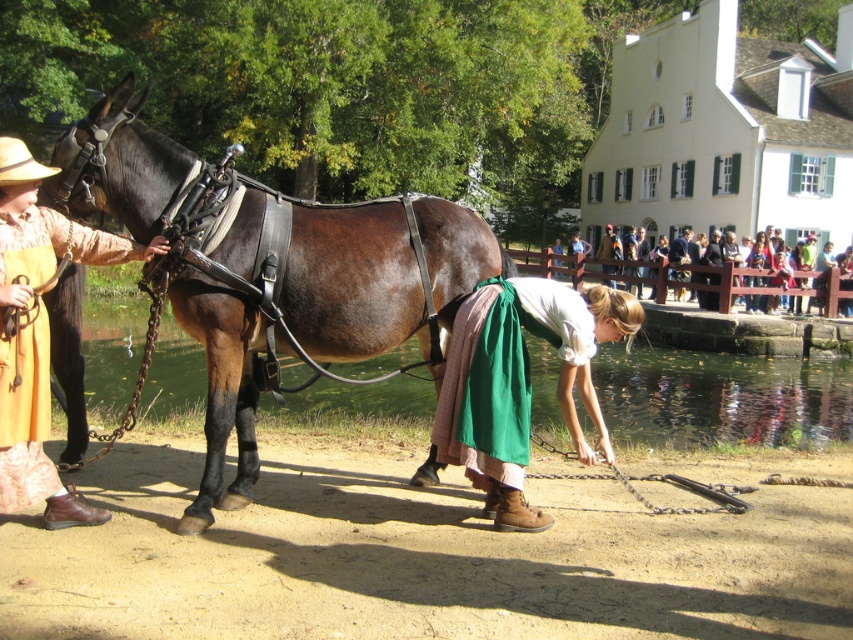
You are standing at the point with coordinates (x=519, y=381) in the historical reenactment scene. What is the object directly beneath your feet?

The point at (x=519, y=381) is on the green fabric skirt at lower center, so the object directly beneath your feet is the green fabric skirt at lower center.

What object is located at the coordinates point (352, 282) in the scene?

The shiny brown leather harness at center is located at point (352, 282).

In the historical reenactment scene near the water, you see a shiny brown leather harness at center and a green fabric skirt at lower center. Which object is positioned to the right side from the observer?

The green fabric skirt at lower center is positioned to the right side from the observer because the shiny brown leather harness at center is to the left of it.